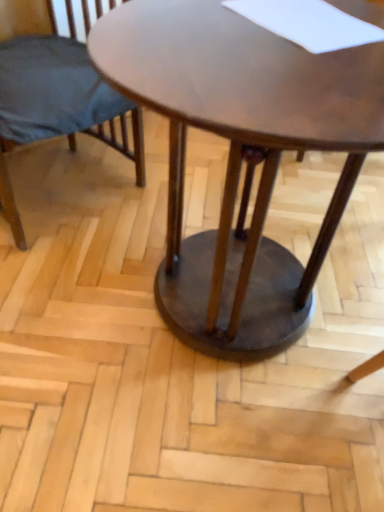
The image size is (384, 512). What do you see at coordinates (240, 157) in the screenshot? I see `shiny brown wood coffee table at center` at bounding box center [240, 157].

This screenshot has width=384, height=512. Find the location of `shiny brown wood coffee table at center`. shiny brown wood coffee table at center is located at coordinates click(240, 157).

This screenshot has height=512, width=384. In order to click on matte dark blue fabric chair at left in this screenshot , I will do tap(54, 94).

What do you see at coordinates (54, 94) in the screenshot? I see `matte dark blue fabric chair at left` at bounding box center [54, 94].

Find the location of a particular element. The width and height of the screenshot is (384, 512). shiny brown wood coffee table at center is located at coordinates (240, 157).

Considering the relative positions of shiny brown wood coffee table at center and matte dark blue fabric chair at left in the image provided, is shiny brown wood coffee table at center to the left of matte dark blue fabric chair at left from the viewer's perspective?

No, shiny brown wood coffee table at center is not to the left of matte dark blue fabric chair at left.

Which is in front, shiny brown wood coffee table at center or matte dark blue fabric chair at left?

shiny brown wood coffee table at center.

Is point (260, 334) in front of point (56, 49)?

Yes, it is in front of point (56, 49).

From the image's perspective, between shiny brown wood coffee table at center and matte dark blue fabric chair at left, who is located below?

shiny brown wood coffee table at center is shown below in the image.

Looking at this image, from a real-world perspective, who is located higher, shiny brown wood coffee table at center or matte dark blue fabric chair at left?

shiny brown wood coffee table at center is physically above.

Can you confirm if shiny brown wood coffee table at center is wider than matte dark blue fabric chair at left?

Yes.

Is shiny brown wood coffee table at center shorter than matte dark blue fabric chair at left?

No, shiny brown wood coffee table at center is not shorter than matte dark blue fabric chair at left.

Considering the sizes of objects shiny brown wood coffee table at center and matte dark blue fabric chair at left in the image provided, who is bigger, shiny brown wood coffee table at center or matte dark blue fabric chair at left?

shiny brown wood coffee table at center.

Is matte dark blue fabric chair at left located within shiny brown wood coffee table at center?

Actually, matte dark blue fabric chair at left is outside shiny brown wood coffee table at center.

Is shiny brown wood coffee table at center next to matte dark blue fabric chair at left?

shiny brown wood coffee table at center and matte dark blue fabric chair at left are clearly separated.

Does shiny brown wood coffee table at center turn towards matte dark blue fabric chair at left?

No, shiny brown wood coffee table at center is not oriented towards matte dark blue fabric chair at left.

Can you tell me how much shiny brown wood coffee table at center and matte dark blue fabric chair at left differ in facing direction?

The facing directions of shiny brown wood coffee table at center and matte dark blue fabric chair at left are 5.59 degrees apart.

Measure the distance from shiny brown wood coffee table at center to matte dark blue fabric chair at left.

shiny brown wood coffee table at center and matte dark blue fabric chair at left are 23.61 inches apart.

The width and height of the screenshot is (384, 512). In order to click on chair located above the shiny brown wood coffee table at center (from the image's perspective) in this screenshot , I will do `click(54, 94)`.

Does matte dark blue fabric chair at left appear on the left side of shiny brown wood coffee table at center?

Yes.

Which is behind, matte dark blue fabric chair at left or shiny brown wood coffee table at center?

matte dark blue fabric chair at left is behind.

Is point (3, 143) less distant than point (296, 262)?

That is False.

From the image's perspective, is matte dark blue fabric chair at left located above or below shiny brown wood coffee table at center?

matte dark blue fabric chair at left is above shiny brown wood coffee table at center.

From a real-world perspective, is matte dark blue fabric chair at left physically located above or below shiny brown wood coffee table at center?

In terms of real-world spatial position, matte dark blue fabric chair at left is below shiny brown wood coffee table at center.

Which object is thinner, matte dark blue fabric chair at left or shiny brown wood coffee table at center?

matte dark blue fabric chair at left is thinner.

Considering the relative sizes of matte dark blue fabric chair at left and shiny brown wood coffee table at center in the image provided, is matte dark blue fabric chair at left shorter than shiny brown wood coffee table at center?

Correct, matte dark blue fabric chair at left is not as tall as shiny brown wood coffee table at center.

Who is smaller, matte dark blue fabric chair at left or shiny brown wood coffee table at center?

matte dark blue fabric chair at left is smaller.

Do you think matte dark blue fabric chair at left is within shiny brown wood coffee table at center, or outside of it?

matte dark blue fabric chair at left lies outside shiny brown wood coffee table at center.

Looking at this image, is matte dark blue fabric chair at left with shiny brown wood coffee table at center?

No, matte dark blue fabric chair at left is not making contact with shiny brown wood coffee table at center.

Does matte dark blue fabric chair at left turn towards shiny brown wood coffee table at center?

Yes, matte dark blue fabric chair at left is facing shiny brown wood coffee table at center.

How different are the orientations of matte dark blue fabric chair at left and shiny brown wood coffee table at center in degrees?

The angle between the facing direction of matte dark blue fabric chair at left and the facing direction of shiny brown wood coffee table at center is 5.59 degrees.

Could you measure the distance between matte dark blue fabric chair at left and shiny brown wood coffee table at center?

A distance of 23.61 inches exists between matte dark blue fabric chair at left and shiny brown wood coffee table at center.

Find the location of a particular element. The width and height of the screenshot is (384, 512). coffee table to the right of matte dark blue fabric chair at left is located at coordinates (240, 157).

Identify the location of chair that appears behind the shiny brown wood coffee table at center. (54, 94).

I want to click on chair above the shiny brown wood coffee table at center (from the image's perspective), so click(54, 94).